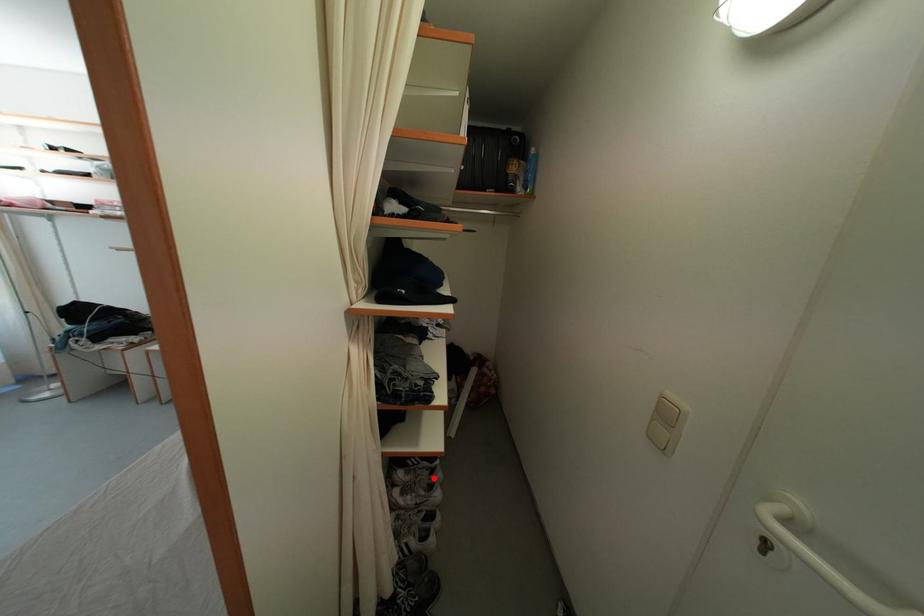
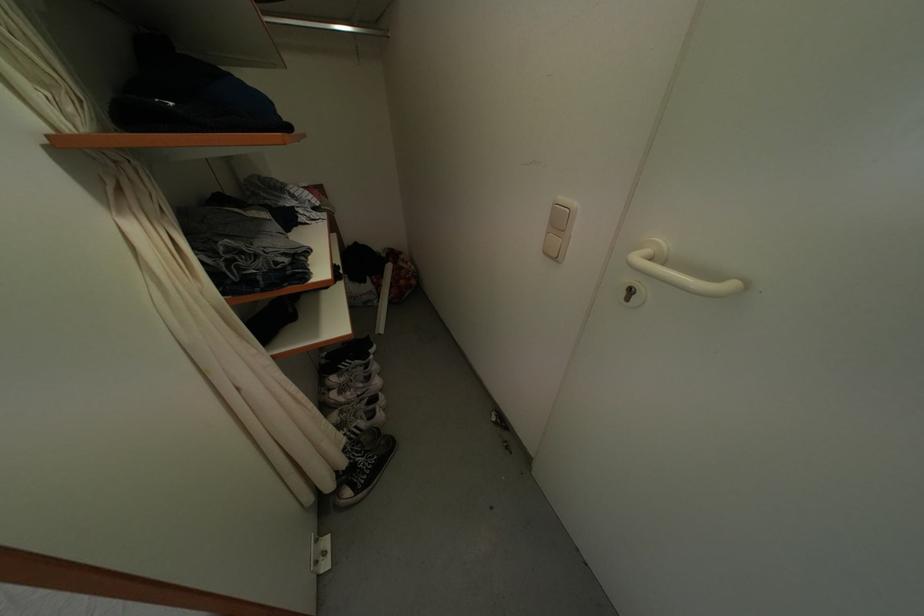
In the second image, find the point that corresponds to the highlighted location in the first image.

(369, 374)